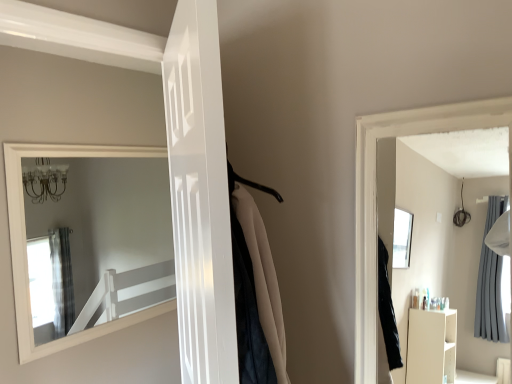
Question: From a real-world perspective, relative to white glossy door at upper left, the 1th door viewed from the left, is white glossy door at center, which ranks as the 2th door in left-to-right order, vertically above or below?

Choices:
 (A) below
 (B) above

Answer: (A)

Question: Do you think white glossy door at center, which ranks as the 2th door in left-to-right order, is within white glossy door at upper left, the 1th door viewed from the left, or outside of it?

Choices:
 (A) outside
 (B) inside

Answer: (A)

Question: Considering their positions, is white glossy door at center, which ranks as the 2th door in left-to-right order, located in front of or behind white glossy door at upper left, the 1th door viewed from the left?

Choices:
 (A) front
 (B) behind

Answer: (A)

Question: In terms of height, does white glossy door at upper left, the 1th door viewed from the left, look taller or shorter compared to white glossy door at center, which ranks as the first door in right-to-left order?

Choices:
 (A) tall
 (B) short

Answer: (A)

Question: Is white glossy door at upper left, the 2th door positioned from the right, spatially inside white glossy door at center, which ranks as the 2th door in left-to-right order, or outside of it?

Choices:
 (A) outside
 (B) inside

Answer: (A)

Question: Based on their positions, is white glossy door at upper left, the 1th door viewed from the left, located to the left or right of white glossy door at center, which ranks as the 2th door in left-to-right order?

Choices:
 (A) right
 (B) left

Answer: (B)

Question: Looking at their shapes, would you say white glossy door at upper left, the 1th door viewed from the left, is wider or thinner than white glossy door at center, which ranks as the 2th door in left-to-right order?

Choices:
 (A) thin
 (B) wide

Answer: (A)